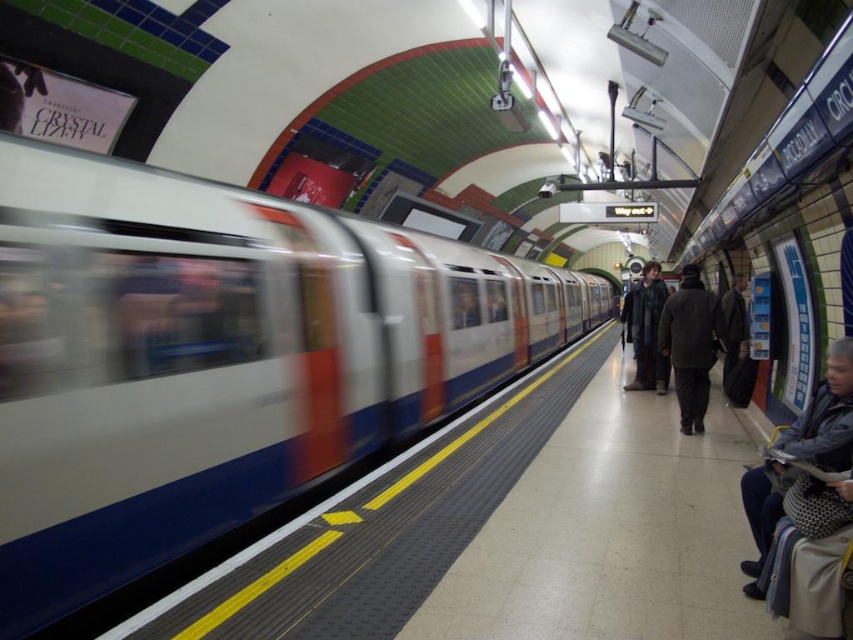
Does metallic silver train at left lie in front of dark gray coat at center?

Yes, it is.

Between metallic silver train at left and dark gray coat at center, which one is positioned lower?

dark gray coat at center is lower down.

Who is more forward, (323,403) or (648,317)?

Point (323,403) is in front.

Identify the location of metallic silver train at left. (219, 358).

Is dark brown wool coat at center above dark gray coat at center?

Yes, dark brown wool coat at center is above dark gray coat at center.

The width and height of the screenshot is (853, 640). I want to click on dark brown wool coat at center, so click(689, 344).

Is point (683, 337) positioned after point (662, 288)?

No, (683, 337) is closer to viewer.

The width and height of the screenshot is (853, 640). In order to click on dark brown wool coat at center in this screenshot , I will do `click(689, 344)`.

Is dark gray fabric jacket at lower right taller than dark brown wool coat at center?

Indeed, dark gray fabric jacket at lower right has a greater height compared to dark brown wool coat at center.

Between point (740, 492) and point (697, 404), which one is positioned in front?

Point (740, 492) is more forward.

Locate an element on the screen. The width and height of the screenshot is (853, 640). dark gray fabric jacket at lower right is located at coordinates (825, 417).